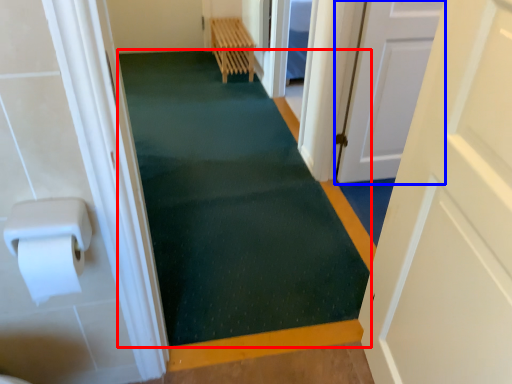
Question: Among these objects, which one is nearest to the camera, bath mat (highlighted by a red box) or door (highlighted by a blue box)?

Choices:
 (A) bath mat
 (B) door

Answer: (A)